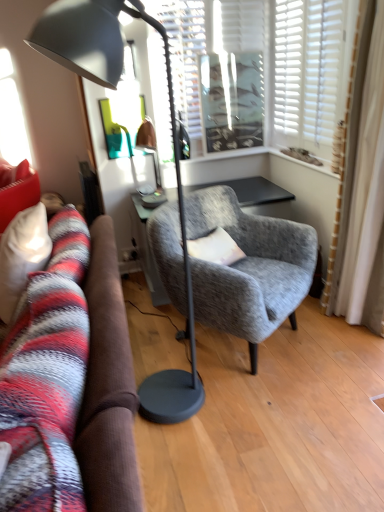
Image resolution: width=384 pixels, height=512 pixels. What do you see at coordinates (174, 156) in the screenshot?
I see `matte black floor lamp at left` at bounding box center [174, 156].

Describe the element at coordinates (249, 268) in the screenshot. I see `textured gray armchair at center` at that location.

At what (x,y) coordinates should I click in order to perform the action: click on soft gray fabric pillow at center. Please return your answer as a coordinate pair (x, y). Looking at the image, I should click on (215, 248).

Where is `matte black floor lamp at left`? The image size is (384, 512). matte black floor lamp at left is located at coordinates (174, 156).

Consider the image. Between white textured blinds at upper center and soft gray fabric pillow at center, which one appears on the right side from the viewer's perspective?

Positioned to the right is white textured blinds at upper center.

Considering the sizes of objects white textured blinds at upper center and soft gray fabric pillow at center in the image provided, who is taller, white textured blinds at upper center or soft gray fabric pillow at center?

white textured blinds at upper center is taller.

Find the location of `pillow that appears below the white textured blinds at upper center (from a real-world perspective)`. pillow that appears below the white textured blinds at upper center (from a real-world perspective) is located at coordinates (215, 248).

Based on the photo, how many degrees apart are the facing directions of white textured blinds at upper center and soft gray fabric pillow at center?

34.9 degrees separate the facing orientations of white textured blinds at upper center and soft gray fabric pillow at center.

Consider the image. Who is smaller, matte black floor lamp at left or textured gray armchair at center?

Smaller between the two is matte black floor lamp at left.

Which object is thinner, matte black floor lamp at left or textured gray armchair at center?

Thinner between the two is matte black floor lamp at left.

Between matte black floor lamp at left and textured gray armchair at center, which one is positioned behind?

textured gray armchair at center.

Considering the relative sizes of soft gray fabric pillow at center and matte black floor lamp at left in the image provided, is soft gray fabric pillow at center shorter than matte black floor lamp at left?

Correct, soft gray fabric pillow at center is not as tall as matte black floor lamp at left.

Which is more to the right, soft gray fabric pillow at center or matte black floor lamp at left?

From the viewer's perspective, soft gray fabric pillow at center appears more on the right side.

From the image's perspective, which is below, soft gray fabric pillow at center or matte black floor lamp at left?

soft gray fabric pillow at center is shown below in the image.

Are soft gray fabric pillow at center and matte black floor lamp at left making contact?

No, soft gray fabric pillow at center is not making contact with matte black floor lamp at left.

Could you tell me if textured gray armchair at center is facing soft gray fabric pillow at center?

Yes, textured gray armchair at center is turned towards soft gray fabric pillow at center.

Can you confirm if textured gray armchair at center is positioned to the right of soft gray fabric pillow at center?

Yes.

Do you think textured gray armchair at center is within soft gray fabric pillow at center, or outside of it?

The correct answer is: outside.

Can you tell me how much textured gray armchair at center and soft gray fabric pillow at center differ in facing direction?

They differ by 5.81 degrees in their facing directions.

Which is closer, (293, 321) or (73, 62)?

The point (73, 62) is in front.

Considering the sizes of objects textured gray armchair at center and matte black floor lamp at left in the image provided, who is thinner, textured gray armchair at center or matte black floor lamp at left?

matte black floor lamp at left is thinner.

Considering the relative positions of textured gray armchair at center and matte black floor lamp at left in the image provided, is textured gray armchair at center to the left of matte black floor lamp at left from the viewer's perspective?

In fact, textured gray armchair at center is to the right of matte black floor lamp at left.

In terms of size, does matte black floor lamp at left appear bigger or smaller than white textured blinds at upper center?

Considering their sizes, matte black floor lamp at left takes up more space than white textured blinds at upper center.

The image size is (384, 512). Find the location of `window that appears behind the matte black floor lamp at left`. window that appears behind the matte black floor lamp at left is located at coordinates (291, 61).

Which of these two, matte black floor lamp at left or white textured blinds at upper center, is thinner?

With smaller width is white textured blinds at upper center.

Does matte black floor lamp at left have a greater height compared to white textured blinds at upper center?

Yes.

Based on their positions, is white textured blinds at upper center located to the left or right of textured gray armchair at center?

From the image, it's evident that white textured blinds at upper center is to the left of textured gray armchair at center.

Based on their sizes in the image, would you say white textured blinds at upper center is bigger or smaller than textured gray armchair at center?

Clearly, white textured blinds at upper center is smaller in size than textured gray armchair at center.

Considering the relative positions of white textured blinds at upper center and textured gray armchair at center in the image provided, is white textured blinds at upper center in front of textured gray armchair at center?

No, white textured blinds at upper center is further to the viewer.

Between point (290, 68) and point (254, 373), which one is positioned behind?

Positioned behind is point (290, 68).

Identify the location of window that is behind the soft gray fabric pillow at center. Image resolution: width=384 pixels, height=512 pixels. (291, 61).

At what (x,y) coordinates should I click in order to perform the action: click on chair below the matte black floor lamp at left (from the image's perspective). Please return your answer as a coordinate pair (x, y). Looking at the image, I should click on (249, 268).

Which object lies nearer to the anchor point soft gray fabric pillow at center, matte black floor lamp at left or textured gray armchair at center?

textured gray armchair at center is closer to soft gray fabric pillow at center.

Which object lies further to the anchor point matte black floor lamp at left, soft gray fabric pillow at center or white textured blinds at upper center?

white textured blinds at upper center.

When comparing their distances from white textured blinds at upper center, does textured gray armchair at center or soft gray fabric pillow at center seem further?

soft gray fabric pillow at center is further to white textured blinds at upper center.

When comparing their distances from soft gray fabric pillow at center, does textured gray armchair at center or matte black floor lamp at left seem further?

matte black floor lamp at left.

Looking at the image, which one is located further to matte black floor lamp at left, white textured blinds at upper center or soft gray fabric pillow at center?

white textured blinds at upper center lies further to matte black floor lamp at left than the other object.

In the scene shown: Based on their spatial positions, is matte black floor lamp at left or soft gray fabric pillow at center closer to white textured blinds at upper center?

matte black floor lamp at left is closer to white textured blinds at upper center.

From the image, which object appears to be farther from soft gray fabric pillow at center, textured gray armchair at center or white textured blinds at upper center?

white textured blinds at upper center is further to soft gray fabric pillow at center.

Estimate the real-world distances between objects in this image. Which object is closer to white textured blinds at upper center, soft gray fabric pillow at center or textured gray armchair at center?

textured gray armchair at center is positioned closer to the anchor white textured blinds at upper center.

You are a GUI agent. You are given a task and a screenshot of the screen. Output one action in this format:
    pyautogui.click(x=<x>, y=<y>)
    Task: Click on the pillow between white textured blinds at upper center and textured gray armchair at center in the vertical direction
    The image size is (384, 512).
    Given the screenshot: What is the action you would take?
    pyautogui.click(x=215, y=248)

Locate an element on the screen. The height and width of the screenshot is (512, 384). pillow between matte black floor lamp at left and white textured blinds at upper center along the z-axis is located at coordinates (215, 248).

The width and height of the screenshot is (384, 512). In order to click on chair between matte black floor lamp at left and soft gray fabric pillow at center in the front-back direction in this screenshot , I will do `click(249, 268)`.

Identify the location of chair positioned between matte black floor lamp at left and white textured blinds at upper center from near to far. (249, 268).